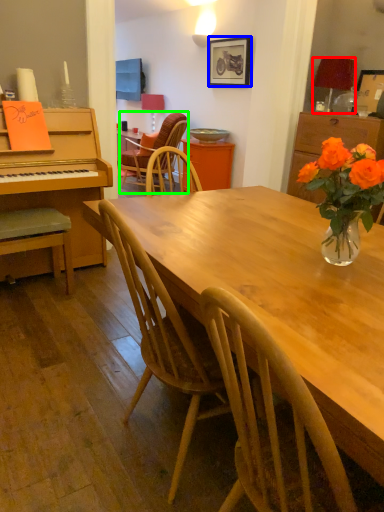
Question: Based on their relative distances, which object is farther from lamp (highlighted by a red box)? Choose from picture frame (highlighted by a blue box) and chair (highlighted by a green box).

Choices:
 (A) picture frame
 (B) chair

Answer: (B)